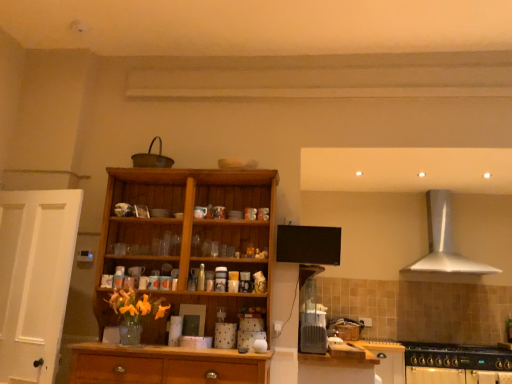
Question: Could you tell me if wooden cabinet at lower center, positioned as the 1th cabinetry in front-to-back order, is turned towards silver metallic range hood at upper right?

Choices:
 (A) yes
 (B) no

Answer: (B)

Question: From the image's perspective, is wooden cabinet at lower center, which is the second cabinetry from right to left, over silver metallic range hood at upper right?

Choices:
 (A) yes
 (B) no

Answer: (B)

Question: Is the position of wooden cabinet at lower center, positioned as the 1th cabinetry in front-to-back order, more distant than that of silver metallic range hood at upper right?

Choices:
 (A) no
 (B) yes

Answer: (A)

Question: Considering the relative sizes of wooden cabinet at lower center, the 2th cabinetry from the back, and silver metallic range hood at upper right in the image provided, is wooden cabinet at lower center, the 2th cabinetry from the back, bigger than silver metallic range hood at upper right?

Choices:
 (A) no
 (B) yes

Answer: (A)

Question: Is wooden cabinet at lower center, which is the second cabinetry from right to left, positioned far away from silver metallic range hood at upper right?

Choices:
 (A) no
 (B) yes

Answer: (B)

Question: Is wooden cabinet at lower center, the 1th cabinetry when ordered from left to right, situated inside wooden cabinet at center or outside?

Choices:
 (A) outside
 (B) inside

Answer: (A)

Question: Is point (339, 377) closer or farther from the camera than point (138, 226)?

Choices:
 (A) farther
 (B) closer

Answer: (B)

Question: From a real-world perspective, is wooden cabinet at lower center, the 1th cabinetry when ordered from left to right, above or below wooden cabinet at center?

Choices:
 (A) below
 (B) above

Answer: (A)

Question: From their relative heights in the image, would you say wooden cabinet at lower center, positioned as the 1th cabinetry in front-to-back order, is taller or shorter than wooden cabinet at center?

Choices:
 (A) short
 (B) tall

Answer: (A)

Question: From the image's perspective, relative to wooden cabinet at center, is black matte gas stove at lower right above or below?

Choices:
 (A) above
 (B) below

Answer: (B)

Question: Based on their positions, is black matte gas stove at lower right located to the left or right of wooden cabinet at center?

Choices:
 (A) left
 (B) right

Answer: (B)

Question: In terms of height, does black matte gas stove at lower right look taller or shorter compared to wooden cabinet at center?

Choices:
 (A) short
 (B) tall

Answer: (A)

Question: From a real-world perspective, is black matte gas stove at lower right physically located above or below wooden cabinet at center?

Choices:
 (A) below
 (B) above

Answer: (A)

Question: Does point (449, 196) appear closer or farther from the camera than point (390, 352)?

Choices:
 (A) farther
 (B) closer

Answer: (A)

Question: In the image, is silver metallic range hood at upper right positioned in front of or behind white matte cabinet at lower right, acting as the 2th cabinetry starting from the left?

Choices:
 (A) front
 (B) behind

Answer: (B)